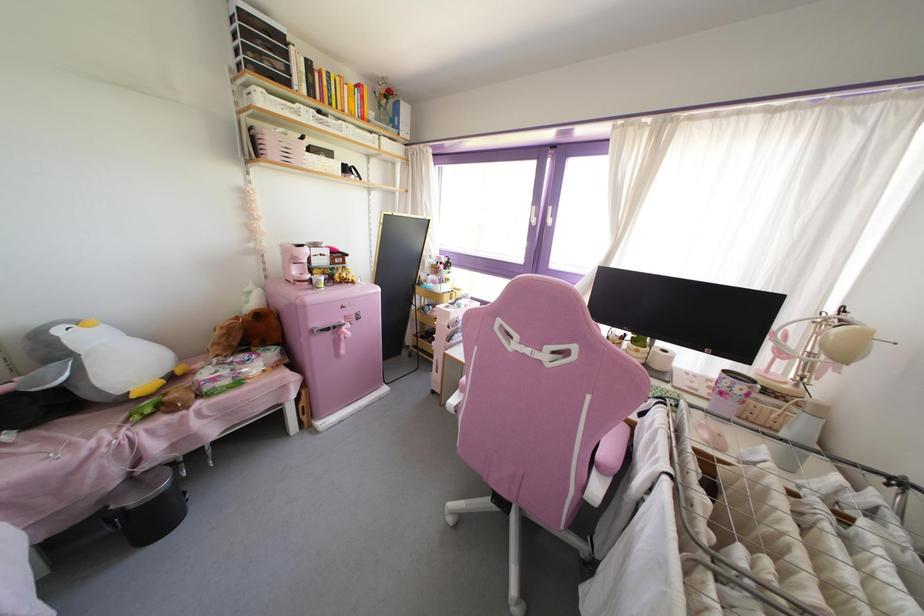
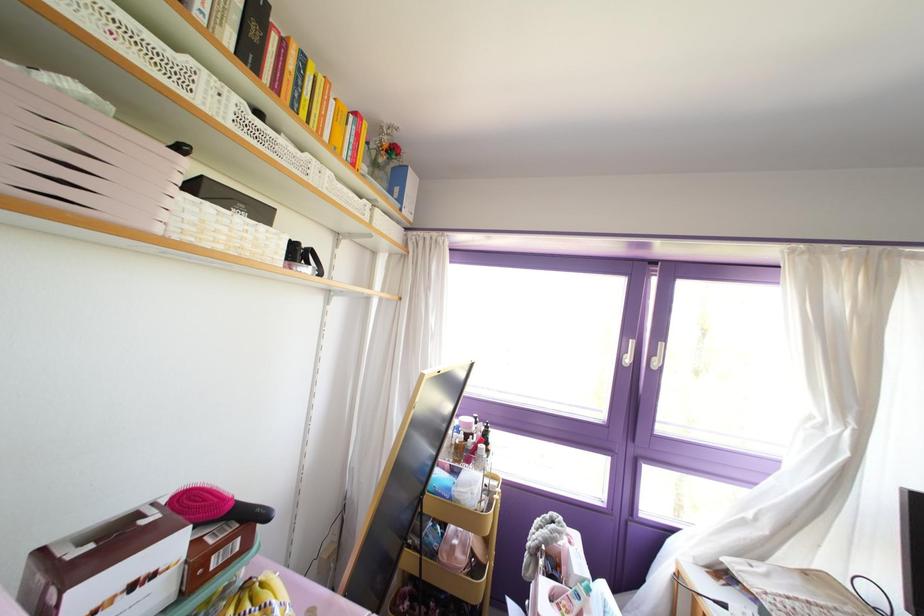
In the second image, find the point that corresponds to (x=360, y=116) in the first image.

(351, 164)